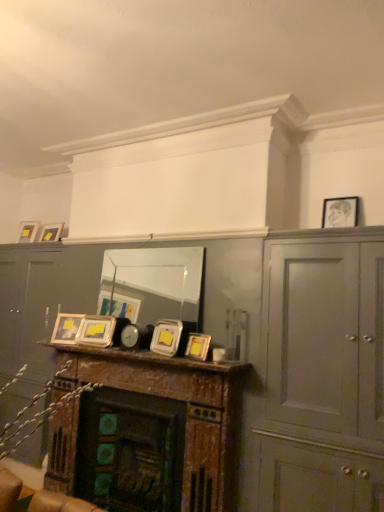
Locate an element on the screen. The height and width of the screenshot is (512, 384). free spot to the right of matte gold picture frame at center, positioned as the sixth picture frame in top-to-bottom order is located at coordinates (220, 362).